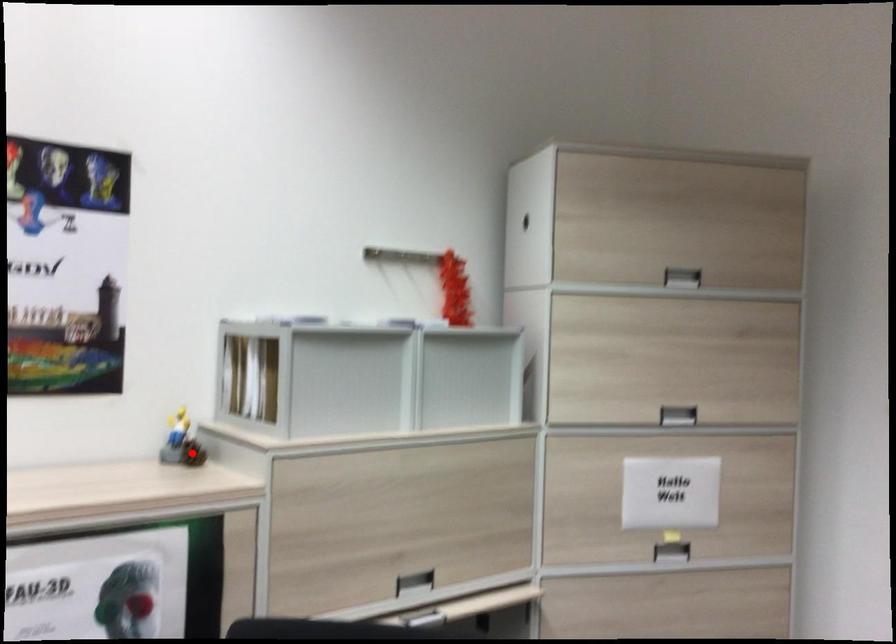
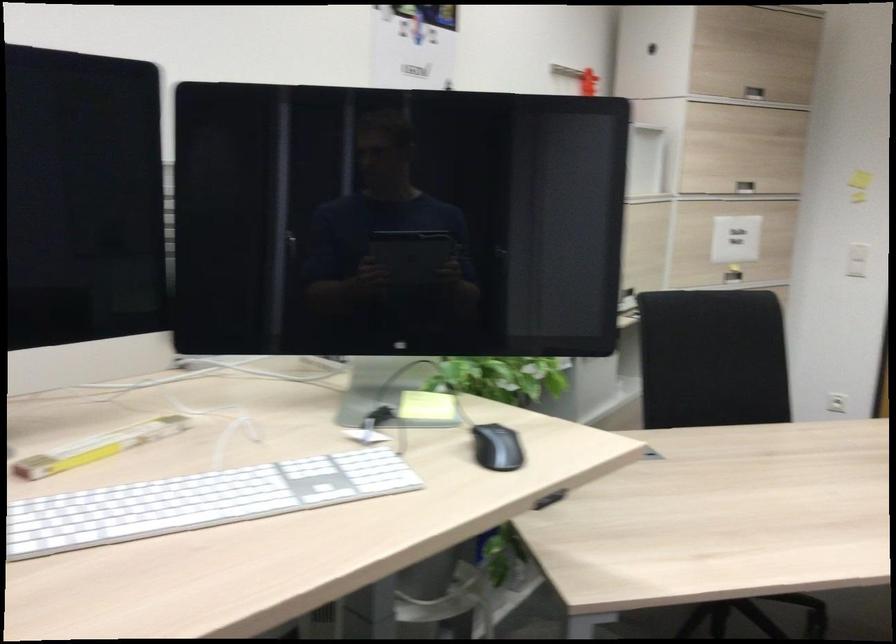
Question: I am providing you with two images of the same scene from different viewpoints. A red point is marked on the first image. Can you still see the location of the red point in image 2?

Choices:
 (A) Yes
 (B) No

Answer: (B)